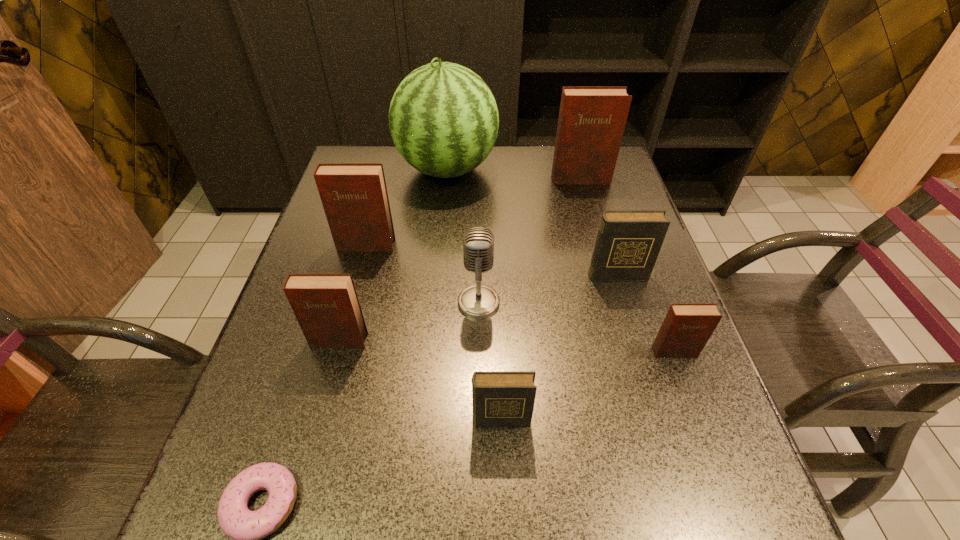
Where is `watermelon`? Image resolution: width=960 pixels, height=540 pixels. watermelon is located at coordinates (443, 118).

At what (x,y) coordinates should I click in order to perform the action: click on green watermelon. Please return your answer as a coordinate pair (x, y). This screenshot has width=960, height=540. Looking at the image, I should click on (443, 118).

Locate an element on the screen. This screenshot has width=960, height=540. the farthest reddish-brown diary is located at coordinates (592, 119).

The image size is (960, 540). In order to click on the tallest diary in this screenshot , I will do `click(592, 119)`.

Locate an element on the screen. This screenshot has height=540, width=960. the third nearest reddish-brown diary is located at coordinates (354, 196).

This screenshot has height=540, width=960. What are the coordinates of `the seventh nearest object` in the screenshot? It's located at (354, 196).

The height and width of the screenshot is (540, 960). What are the coordinates of `gray microphone` in the screenshot? It's located at (478, 301).

Image resolution: width=960 pixels, height=540 pixels. I want to click on the fifth farthest object, so click(478, 301).

At what (x,y) coordinates should I click in order to perform the action: click on the third biggest reddish-brown diary. Please return your answer as a coordinate pair (x, y). Image resolution: width=960 pixels, height=540 pixels. Looking at the image, I should click on (326, 306).

In order to click on the right dark diary in this screenshot , I will do `click(628, 242)`.